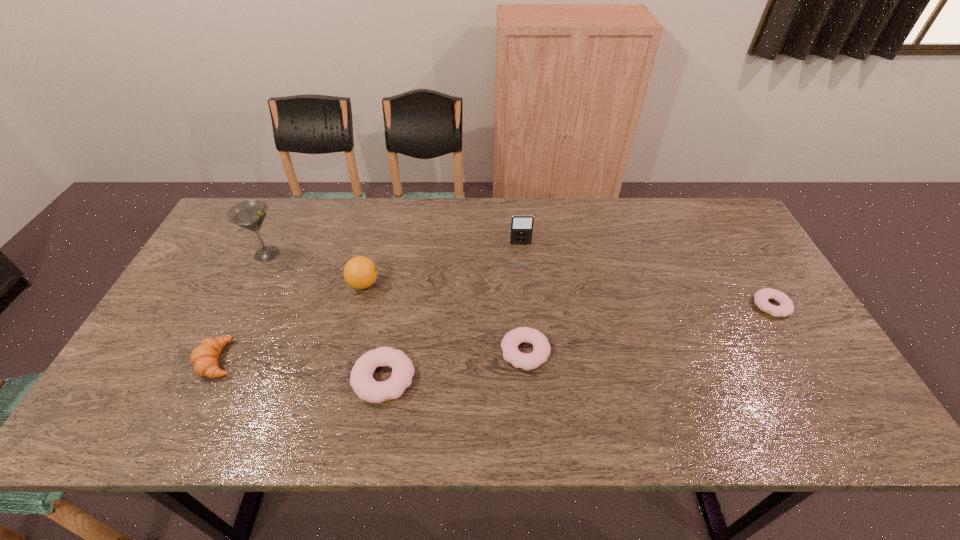
To ensure equal spacing by inserting another doughnut among them, please point out a vacant spot for this new doughnut. Please provide its 2D coordinates. Your answer should be formatted as a tuple, i.e. [(x, y)], where the tuple contains the x and y coordinates of a point satisfying the conditions above.

[(654, 328)]